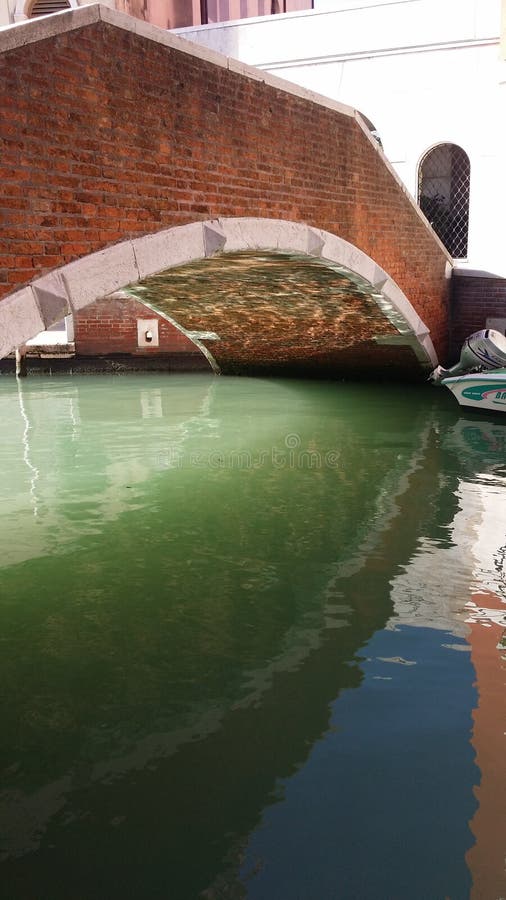
At what (x,y) coordinates should I click in order to perform the action: click on vent. Please return your answer as a coordinate pair (x, y). Image resolution: width=506 pixels, height=900 pixels. Looking at the image, I should click on (46, 5).